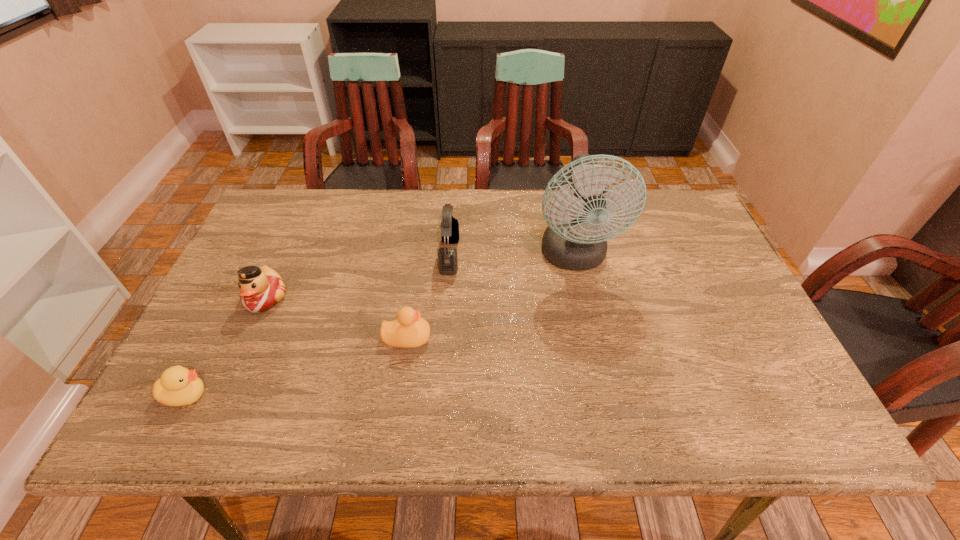
The height and width of the screenshot is (540, 960). I want to click on free location located 0.200m on the face of the farthest duck, so click(x=225, y=390).

The height and width of the screenshot is (540, 960). I want to click on vacant area situated 0.280m on the face of the rightmost duck, so click(547, 338).

Where is `free space located at the beak of the nearest object`? This screenshot has height=540, width=960. free space located at the beak of the nearest object is located at coordinates (246, 395).

Image resolution: width=960 pixels, height=540 pixels. Find the location of `fan that is at the far edge`. fan that is at the far edge is located at coordinates (575, 239).

Where is `headset that is at the far edge`? headset that is at the far edge is located at coordinates 447,256.

Identify the location of object at the near edge. The height and width of the screenshot is (540, 960). (178, 386).

The width and height of the screenshot is (960, 540). Find the location of `object present at the near left corner`. object present at the near left corner is located at coordinates (178, 386).

The height and width of the screenshot is (540, 960). In the image, there is a desktop. Find the location of `vacant area at the far edge`. vacant area at the far edge is located at coordinates (392, 235).

Where is `free point at the near edge`? Image resolution: width=960 pixels, height=540 pixels. free point at the near edge is located at coordinates (478, 430).

Image resolution: width=960 pixels, height=540 pixels. In the image, there is a desktop. In order to click on free space at the left edge in this screenshot , I will do `click(257, 341)`.